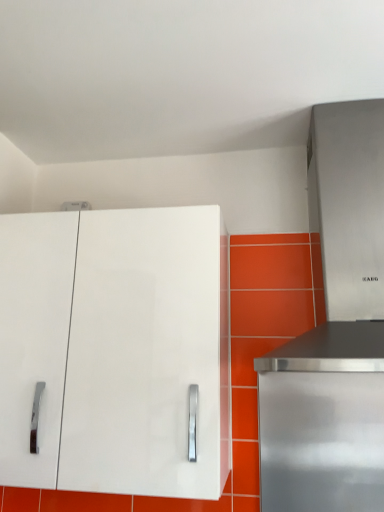
Identify the location of blank space above stainless steel range hood at upper right (from a real-world perspective). (320, 86).